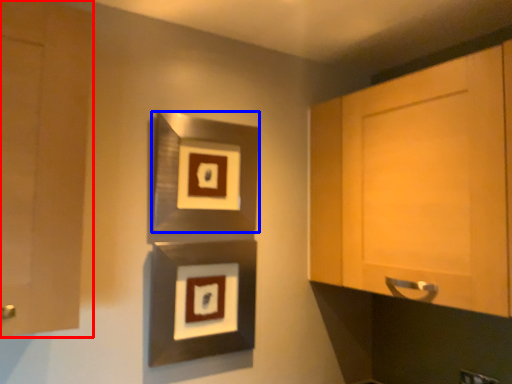
Question: Which object is further to the camera taking this photo, cabinetry (highlighted by a red box) or picture frame (highlighted by a blue box)?

Choices:
 (A) cabinetry
 (B) picture frame

Answer: (B)